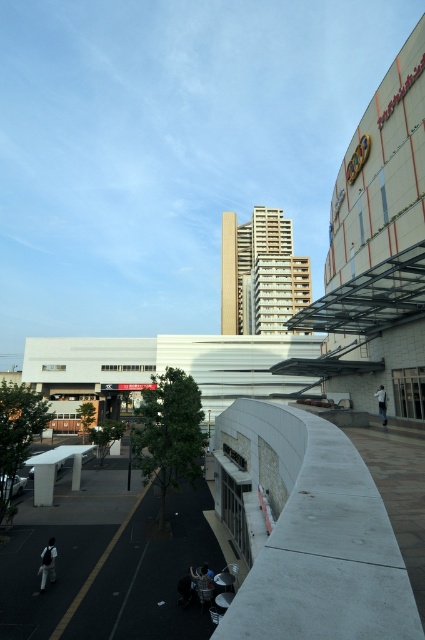
Can you confirm if metallic silver water bottle at lower center is thinner than white fabric bag at lower right?

No.

Is point (204, 593) behind point (382, 403)?

No, it is not.

You are a GUI agent. You are given a task and a screenshot of the screen. Output one action in this format:
    pyautogui.click(x=<x>, y=<y>)
    Task: Click on the metallic silver water bottle at lower center
    
    Given the screenshot: What is the action you would take?
    pyautogui.click(x=203, y=582)

Based on the photo, can you confirm if dark gray fabric jacket at lower left is positioned above white fabric bag at lower right?

Incorrect, dark gray fabric jacket at lower left is not positioned above white fabric bag at lower right.

How distant is dark gray fabric jacket at lower left from white fabric bag at lower right?

They are 13.87 meters apart.

Who is more forward, (51, 580) or (379, 406)?

Positioned in front is point (51, 580).

Identify the location of dark gray fabric jacket at lower left. Image resolution: width=425 pixels, height=640 pixels. (48, 563).

Can you confirm if dark gray fabric jacket at lower left is positioned below metallic silver water bottle at lower center?

Indeed, dark gray fabric jacket at lower left is positioned under metallic silver water bottle at lower center.

Is dark gray fabric jacket at lower left to the right of metallic silver water bottle at lower center from the viewer's perspective?

In fact, dark gray fabric jacket at lower left is to the left of metallic silver water bottle at lower center.

Describe the element at coordinates (48, 563) in the screenshot. The width and height of the screenshot is (425, 640). I see `dark gray fabric jacket at lower left` at that location.

Locate an element on the screen. dark gray fabric jacket at lower left is located at coordinates (48, 563).